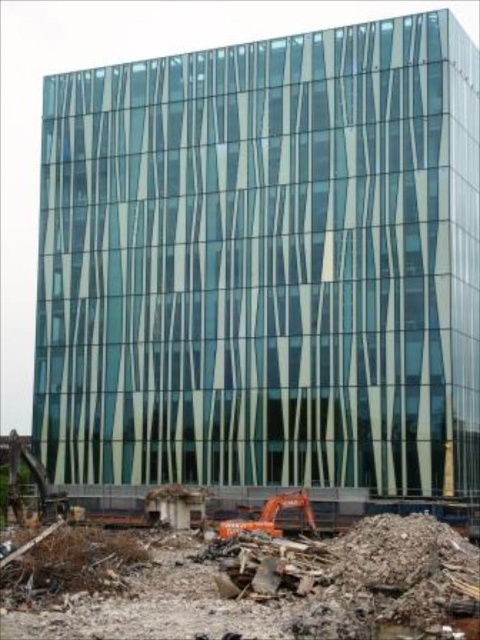
Between rubble concrete at lower center and orange metallic excavator at lower center, which one appears on the right side from the viewer's perspective?

orange metallic excavator at lower center is more to the right.

Who is more forward, (360, 531) or (261, 516)?

Point (360, 531) is in front.

What are the coordinates of `rubble concrete at lower center` in the screenshot? It's located at (253, 586).